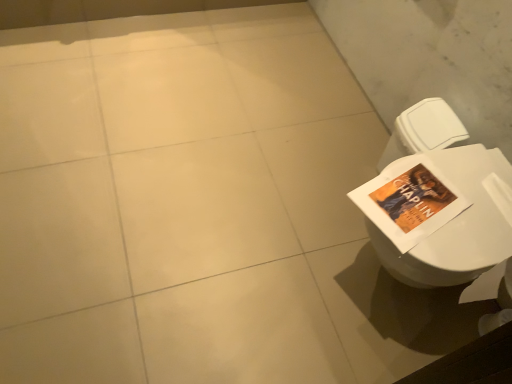
The width and height of the screenshot is (512, 384). I want to click on free location in front of white glossy toilet at right, so click(376, 350).